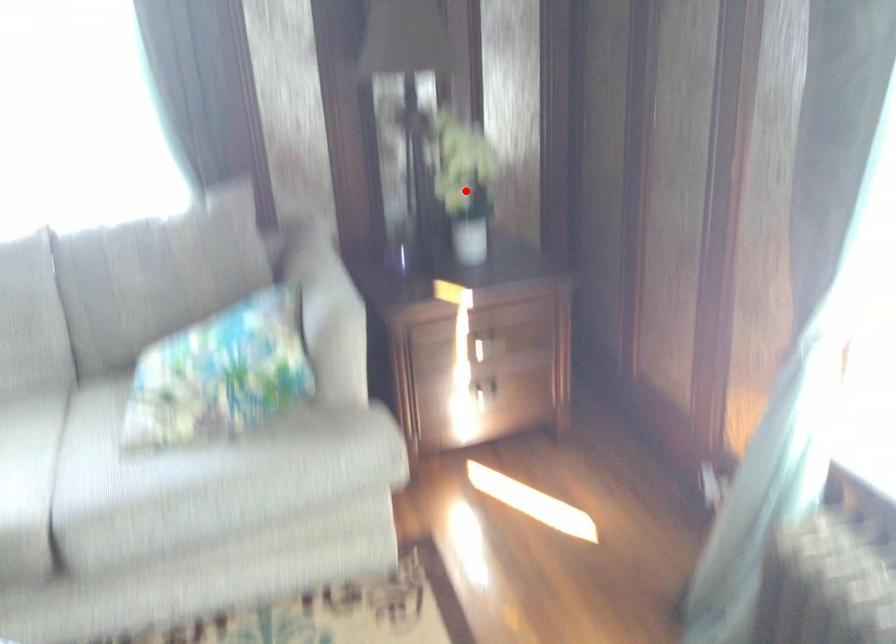
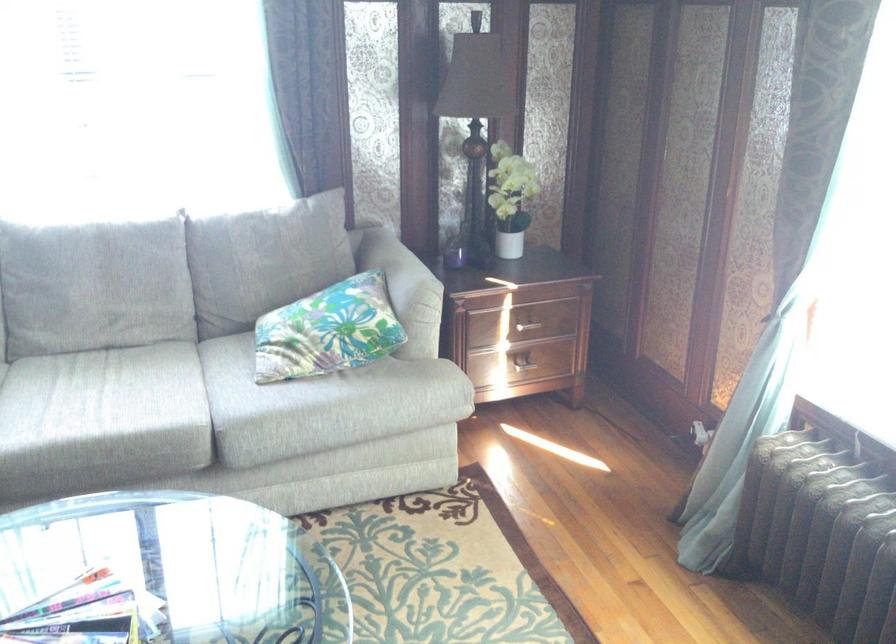
Where in the second image is the point corresponding to the highlighted location from the first image?

(511, 199)